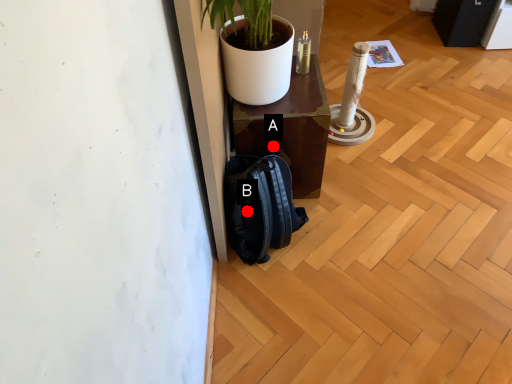
Question: Two points are circled on the image, labeled by A and B beside each circle. Which of the following is the farthest from the observer?

Choices:
 (A) A is further
 (B) B is further

Answer: (A)